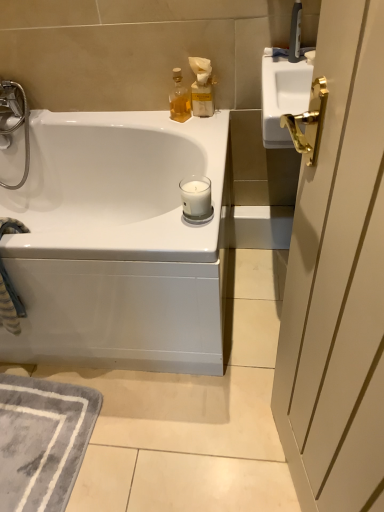
Question: From the image's perspective, is matte beige bottle at upper right on white glossy bathtub at upper left?

Choices:
 (A) yes
 (B) no

Answer: (A)

Question: From a real-world perspective, is matte beige bottle at upper right located higher than white glossy bathtub at upper left?

Choices:
 (A) yes
 (B) no

Answer: (A)

Question: Does matte beige bottle at upper right have a lesser width compared to white glossy bathtub at upper left?

Choices:
 (A) no
 (B) yes

Answer: (B)

Question: Considering the relative sizes of matte beige bottle at upper right and white glossy bathtub at upper left in the image provided, is matte beige bottle at upper right taller than white glossy bathtub at upper left?

Choices:
 (A) yes
 (B) no

Answer: (B)

Question: From a real-world perspective, is matte beige bottle at upper right located beneath white glossy bathtub at upper left?

Choices:
 (A) yes
 (B) no

Answer: (B)

Question: From the image's perspective, is white glass candle at center above or below matte beige bottle at upper right?

Choices:
 (A) below
 (B) above

Answer: (A)

Question: From a real-world perspective, is white glass candle at center positioned above or below matte beige bottle at upper right?

Choices:
 (A) below
 (B) above

Answer: (A)

Question: In the image, is white glass candle at center positioned in front of or behind matte beige bottle at upper right?

Choices:
 (A) behind
 (B) front

Answer: (B)

Question: Do you think white glass candle at center is within matte beige bottle at upper right, or outside of it?

Choices:
 (A) inside
 (B) outside

Answer: (B)

Question: Is point (170, 114) closer or farther from the camera than point (195, 215)?

Choices:
 (A) closer
 (B) farther

Answer: (B)

Question: Looking at the image, does translucent glass bottle at upper center seem bigger or smaller compared to white glass candle at center?

Choices:
 (A) big
 (B) small

Answer: (A)

Question: From a real-world perspective, relative to white glass candle at center, is translucent glass bottle at upper center vertically above or below?

Choices:
 (A) below
 (B) above

Answer: (B)

Question: Considering their positions, is translucent glass bottle at upper center located in front of or behind white glass candle at center?

Choices:
 (A) behind
 (B) front

Answer: (A)

Question: Is white glossy bathtub at upper left spatially inside translucent glass bottle at upper center, or outside of it?

Choices:
 (A) inside
 (B) outside

Answer: (B)

Question: In the image, is white glossy bathtub at upper left on the left side or the right side of translucent glass bottle at upper center?

Choices:
 (A) right
 (B) left

Answer: (B)